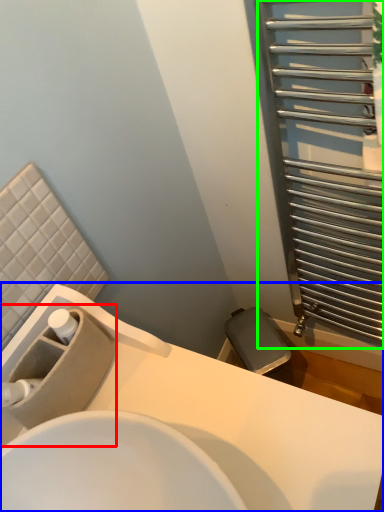
Question: Considering the real-world distances, which object is farthest from sink (highlighted by a red box)? sink (highlighted by a blue box) or screen door (highlighted by a green box)?

Choices:
 (A) sink
 (B) screen door

Answer: (B)